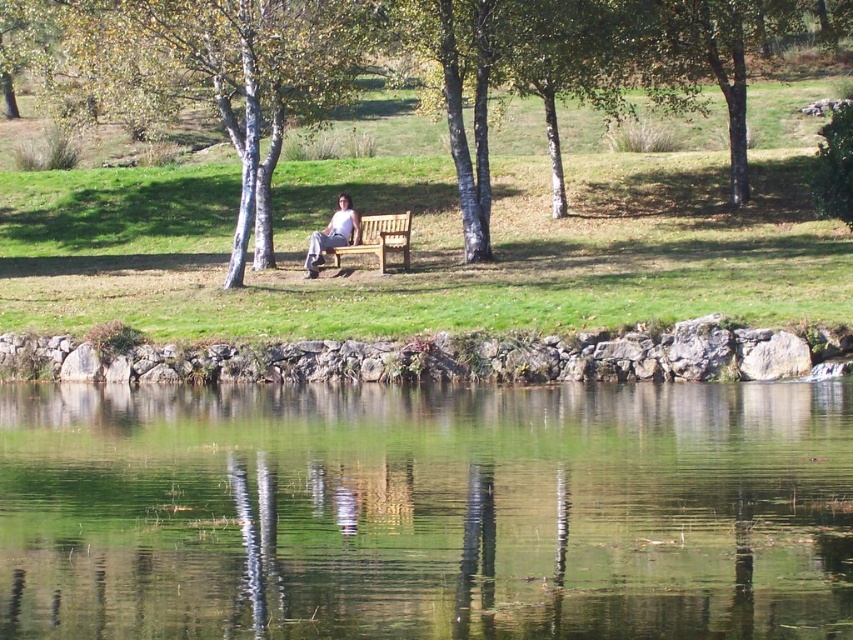
Question: From the image, what is the correct spatial relationship of brown bark tree at center in relation to light blue denim jeans at center?

Choices:
 (A) left
 (B) right

Answer: (A)

Question: Is green bark tree at center smaller than light brown wooden bench at center?

Choices:
 (A) no
 (B) yes

Answer: (A)

Question: Estimate the real-world distances between objects in this image. Which object is closer to the green reflective water at center?

Choices:
 (A) brown bark tree at center
 (B) light blue denim jeans at center

Answer: (A)

Question: Which object is the farthest from the brown bark tree at center?

Choices:
 (A) light brown wooden bench at center
 (B) light blue denim jeans at center

Answer: (B)

Question: Among these objects, which one is nearest to the camera?

Choices:
 (A) light blue denim jeans at center
 (B) light brown wooden bench at center
 (C) brown bark tree at center

Answer: (C)

Question: Does green bark tree at center have a greater width compared to light blue denim jeans at center?

Choices:
 (A) yes
 (B) no

Answer: (A)